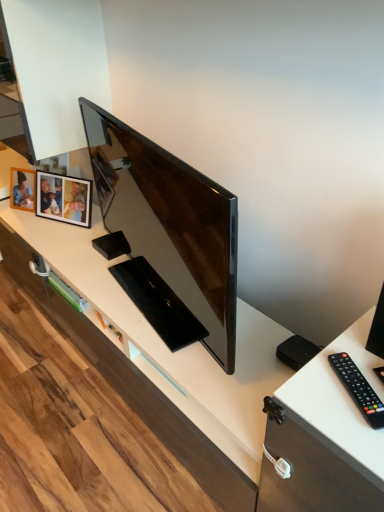
Question: Is wooden photo frame at upper left wider than black plastic remote at right?

Choices:
 (A) yes
 (B) no

Answer: (A)

Question: Is wooden photo frame at upper left bigger than black plastic remote at right?

Choices:
 (A) no
 (B) yes

Answer: (B)

Question: Is wooden photo frame at upper left to the left of black plastic remote at right from the viewer's perspective?

Choices:
 (A) no
 (B) yes

Answer: (B)

Question: Is wooden photo frame at upper left positioned before black plastic remote at right?

Choices:
 (A) no
 (B) yes

Answer: (A)

Question: Is wooden photo frame at upper left thinner than black plastic remote at right?

Choices:
 (A) no
 (B) yes

Answer: (A)

Question: Could you tell me if wooden photo frame at upper left is facing black plastic remote at right?

Choices:
 (A) no
 (B) yes

Answer: (A)

Question: Is wooden photo frame at upper left at the right side of matte black tv at center?

Choices:
 (A) no
 (B) yes

Answer: (A)

Question: Is the position of wooden photo frame at upper left less distant than that of matte black tv at center?

Choices:
 (A) yes
 (B) no

Answer: (B)

Question: Is wooden photo frame at upper left taller than matte black tv at center?

Choices:
 (A) yes
 (B) no

Answer: (B)

Question: Would you consider wooden photo frame at upper left to be distant from matte black tv at center?

Choices:
 (A) yes
 (B) no

Answer: (B)

Question: Can we say wooden photo frame at upper left lies outside matte black tv at center?

Choices:
 (A) no
 (B) yes

Answer: (B)

Question: Is wooden photo frame at upper left bigger than matte black tv at center?

Choices:
 (A) no
 (B) yes

Answer: (A)

Question: Does matte black tv at center have a smaller size compared to wooden photo frame at upper left?

Choices:
 (A) no
 (B) yes

Answer: (A)